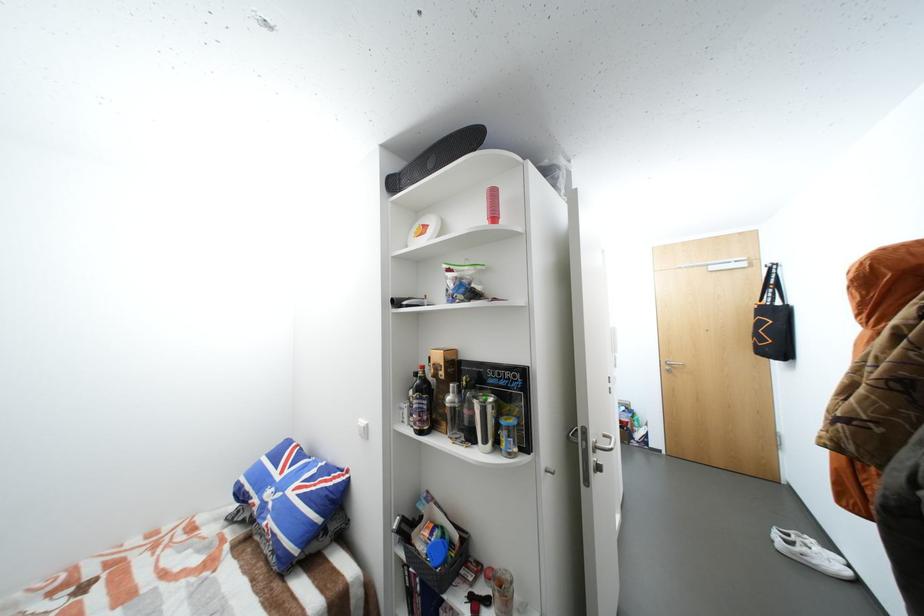
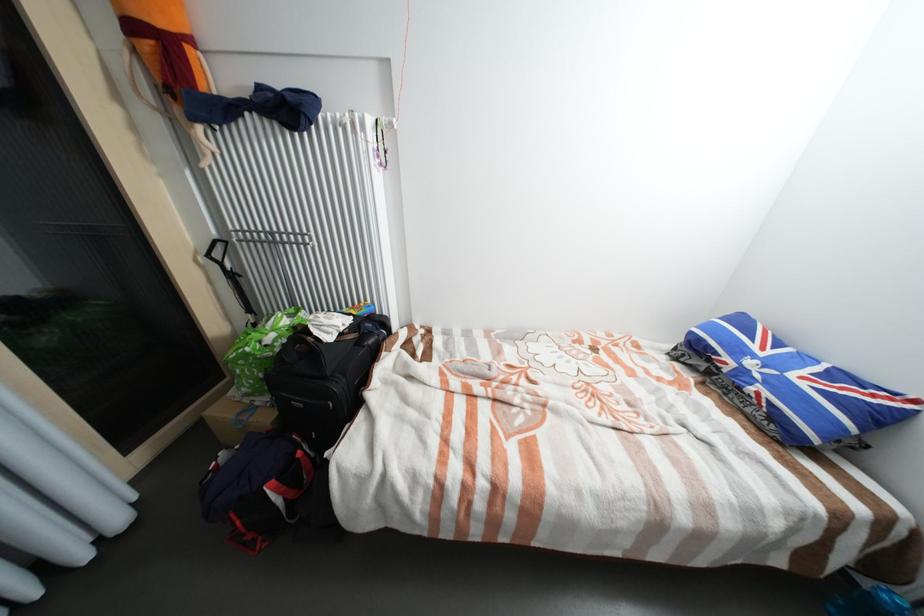
Find the pixel in the second image that matches (x=286, y=479) in the first image.

(769, 354)